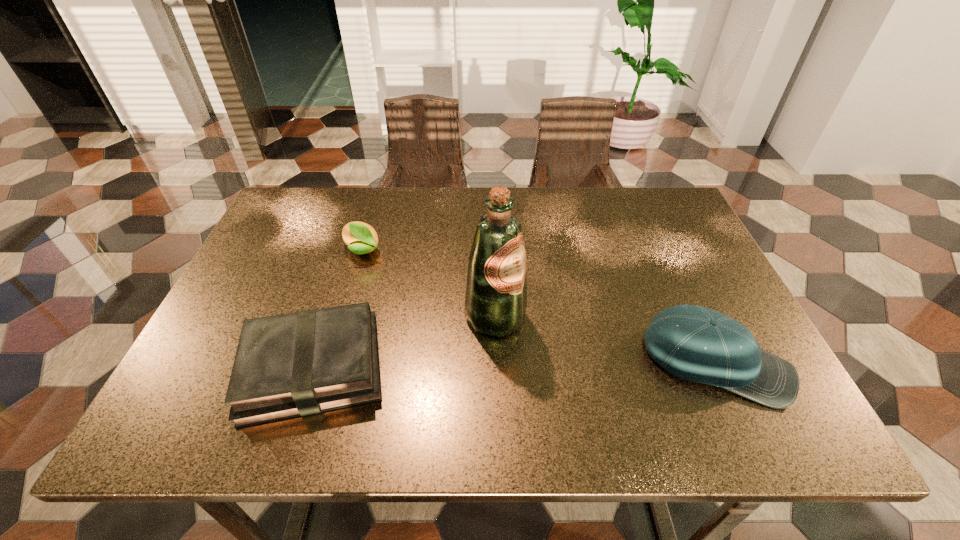
Locate an element on the screen. Image resolution: width=960 pixels, height=540 pixels. the shortest object is located at coordinates (297, 364).

Image resolution: width=960 pixels, height=540 pixels. Find the location of `the rightmost object`. the rightmost object is located at coordinates (695, 343).

Where is `baseball cap`? This screenshot has width=960, height=540. baseball cap is located at coordinates (695, 343).

At what (x,y) coordinates should I click in order to perform the action: click on lemon. Please return your answer as a coordinate pair (x, y). This screenshot has width=960, height=540. Looking at the image, I should click on (361, 238).

The width and height of the screenshot is (960, 540). I want to click on the farthest object, so click(361, 238).

Identify the location of the tallest object. (496, 292).

Where is `olive oil`? olive oil is located at coordinates (496, 292).

At what (x,y) coordinates should I click in order to perform the action: click on free space located on the right of the shortest object. Please return your answer as a coordinate pair (x, y). Looking at the image, I should click on (549, 368).

This screenshot has height=540, width=960. What are the coordinates of `vacant space located on the back of the third shortest object` in the screenshot? It's located at (669, 259).

Find the location of a particular element. This screenshot has width=960, height=540. vacant space positioned 0.280m with leaves positioned above the farthest object is located at coordinates (454, 310).